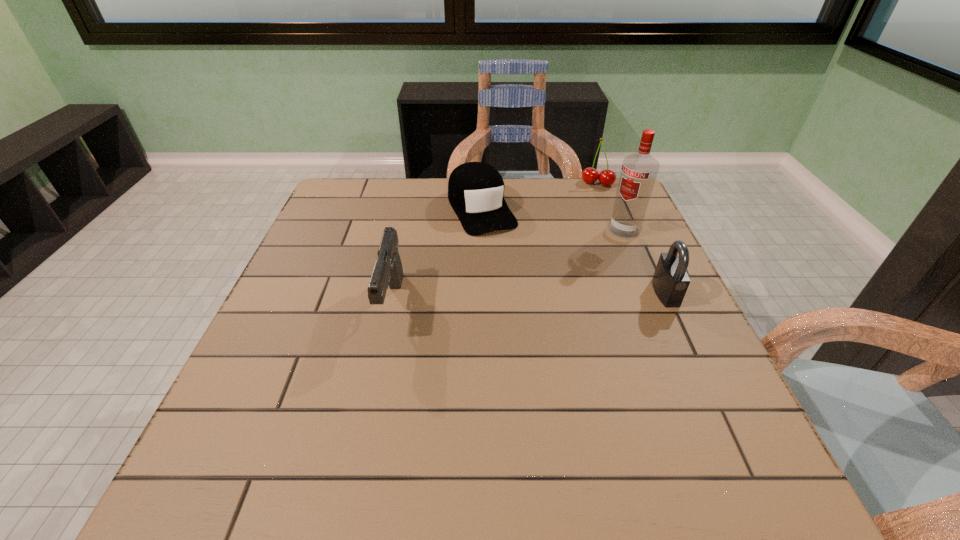
Where is `vacant space situated 0.080m with the stems of the cherry pointing upwards`? The image size is (960, 540). vacant space situated 0.080m with the stems of the cherry pointing upwards is located at coordinates (591, 202).

Locate an element on the screen. The image size is (960, 540). free point located with the stems of the cherry pointing upwards is located at coordinates (582, 240).

Identify the location of free region located with the stems of the cherry pointing upwards. This screenshot has width=960, height=540. (589, 209).

You are a GUI agent. You are given a task and a screenshot of the screen. Output one action in this format:
    pyautogui.click(x=<x>, y=<y>)
    Task: Click on the blank space located on the front-facing side of the fourth object from right to left
    The height and width of the screenshot is (540, 960).
    Given the screenshot: What is the action you would take?
    pyautogui.click(x=525, y=291)

Where is `free space located on the front-facing side of the fourth object from right to left`? The image size is (960, 540). free space located on the front-facing side of the fourth object from right to left is located at coordinates 522,286.

This screenshot has width=960, height=540. In order to click on free space located 0.080m on the front-facing side of the fourth object from right to left in this screenshot , I will do `click(503, 253)`.

Locate an element on the screen. Image resolution: width=960 pixels, height=540 pixels. vodka located at the far edge is located at coordinates (639, 171).

You are a GUI agent. You are given a task and a screenshot of the screen. Output one action in this format:
    pyautogui.click(x=<x>, y=<y>)
    Task: Click on the cherry positioned at the far edge
    This screenshot has width=960, height=540.
    Given the screenshot: What is the action you would take?
    pyautogui.click(x=590, y=175)

Image resolution: width=960 pixels, height=540 pixels. Find the location of `cap present at the far edge`. cap present at the far edge is located at coordinates (475, 189).

I want to click on padlock that is at the right edge, so click(x=671, y=279).